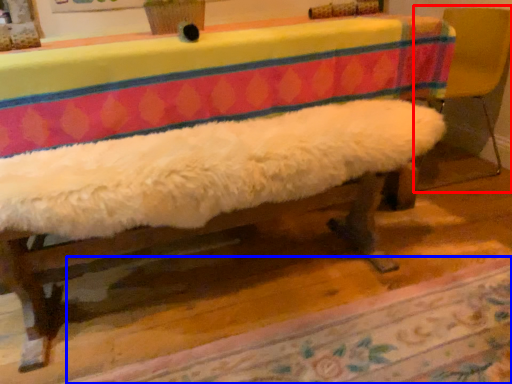
Question: Which object appears closest to the camera in this image, armchair (highlighted by a red box) or mat (highlighted by a blue box)?

Choices:
 (A) armchair
 (B) mat

Answer: (B)